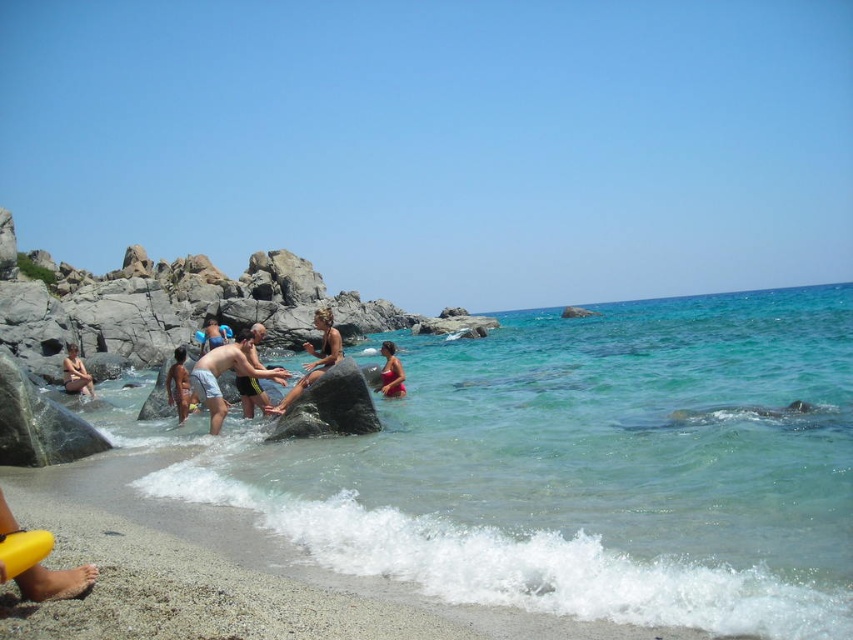
Question: Is clear blue water at center above yellow rubber at lower left?

Choices:
 (A) no
 (B) yes

Answer: (B)

Question: Is clear blue water at center bigger than smooth skin person at center?

Choices:
 (A) no
 (B) yes

Answer: (B)

Question: Estimate the real-world distances between objects in this image. Which object is closer to the smooth blue swim trunks at center?

Choices:
 (A) yellow rubber at lower left
 (B) light blue shorts at center
 (C) matte black swim trunks at center
 (D) matte pink swimsuit at lower center

Answer: (C)

Question: Among these points, which one is farthest from the camera?

Choices:
 (A) (804, 387)
 (B) (183, 378)
 (C) (250, 333)

Answer: (B)

Question: Which object is closer to the camera taking this photo?

Choices:
 (A) light blue shorts at center
 (B) smooth skin person at center
 (C) matte pink swimsuit at lower center
 (D) tan skin human at center

Answer: (B)

Question: Is yellow rubber at lower left wider than smooth blue swim trunks at center?

Choices:
 (A) no
 (B) yes

Answer: (A)